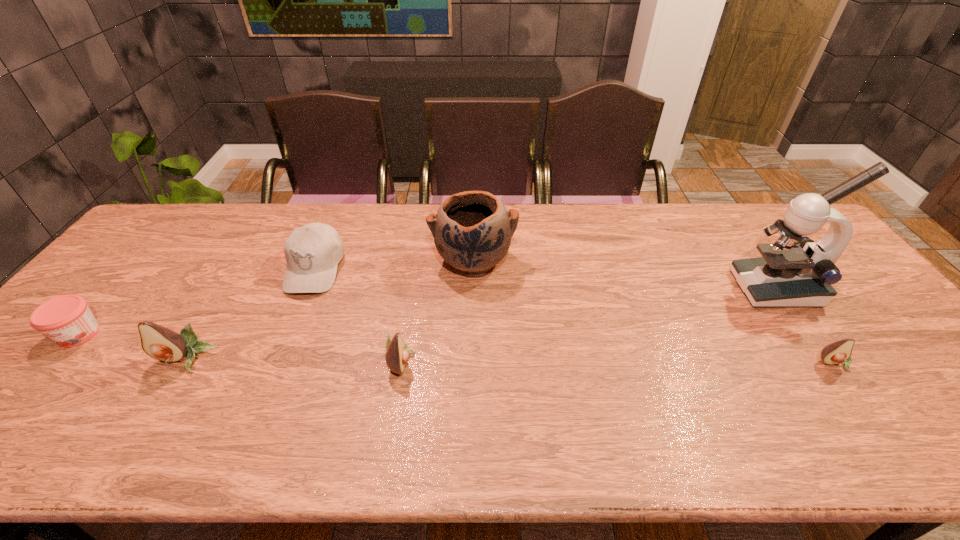
This screenshot has height=540, width=960. I want to click on vacant space located on the seed side of the second avocado from right to left, so click(514, 361).

You are a GUI agent. You are given a task and a screenshot of the screen. Output one action in this format:
    pyautogui.click(x=<x>, y=<y>)
    Task: Click on the free spot located 0.070m on the seed side of the rightmost avocado
    
    Given the screenshot: What is the action you would take?
    pyautogui.click(x=859, y=398)

Locate an element on the screen. vacant space located 0.160m on the left of the fifth object from left to right is located at coordinates (377, 261).

Locate an element on the screen. The image size is (960, 540). free space located on the front label of the leftmost object is located at coordinates (49, 368).

You are a GUI agent. You are given a task and a screenshot of the screen. Output one action in this format:
    pyautogui.click(x=<x>, y=<y>)
    Task: Click on the vacant space located 0.150m on the front-facing side of the fifth object from right to left
    The width and height of the screenshot is (960, 540).
    Given the screenshot: What is the action you would take?
    pyautogui.click(x=285, y=341)

Identify the location of free space located on the right of the microscope. (864, 288).

Identify the location of pottery at the far edge. (472, 230).

At what (x,y) coordinates should I click in order to perform the action: click on baseball cap that is at the far edge. Please return your answer as a coordinate pair (x, y). The image size is (960, 540). Looking at the image, I should click on (313, 251).

The width and height of the screenshot is (960, 540). Find the location of `object that is at the near edge`. object that is at the near edge is located at coordinates (397, 355).

Identify the location of object present at the left edge. The height and width of the screenshot is (540, 960). point(67,320).